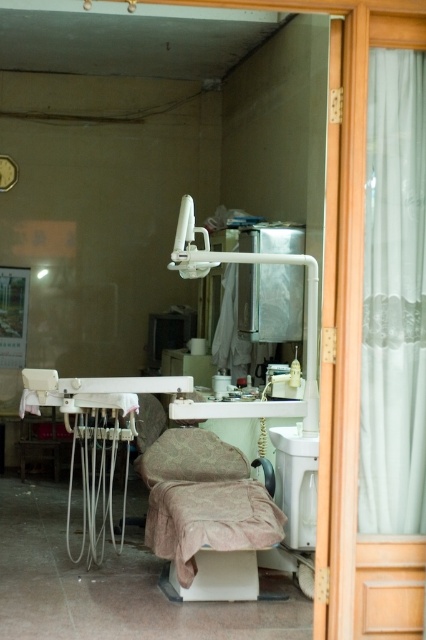
Between white sheer curtain at right and white glossy sink at center, which one is positioned higher?

white sheer curtain at right

Is white sheer curtain at right positioned behind white glossy sink at center?

No, white sheer curtain at right is in front of white glossy sink at center.

This screenshot has height=640, width=426. I want to click on white sheer curtain at right, so click(394, 298).

At what (x,y) coordinates should I click in order to perform the action: click on white sheer curtain at right. Please return your answer as a coordinate pair (x, y). Looking at the image, I should click on (394, 298).

In the scene shown: Does white sheer curtain at right have a larger size compared to pink fabric-covered chair at center?

No, white sheer curtain at right is not bigger than pink fabric-covered chair at center.

Who is positioned more to the right, white sheer curtain at right or pink fabric-covered chair at center?

white sheer curtain at right is more to the right.

Image resolution: width=426 pixels, height=640 pixels. Describe the element at coordinates (394, 298) in the screenshot. I see `white sheer curtain at right` at that location.

Identify the location of white sheer curtain at right. This screenshot has height=640, width=426. (394, 298).

Which of these two, pink fabric-covered chair at center or white glossy sink at center, stands shorter?

white glossy sink at center is shorter.

What do you see at coordinates (190, 483) in the screenshot? This screenshot has width=426, height=640. I see `pink fabric-covered chair at center` at bounding box center [190, 483].

Where is `pink fabric-covered chair at center`? Image resolution: width=426 pixels, height=640 pixels. pink fabric-covered chair at center is located at coordinates (190, 483).